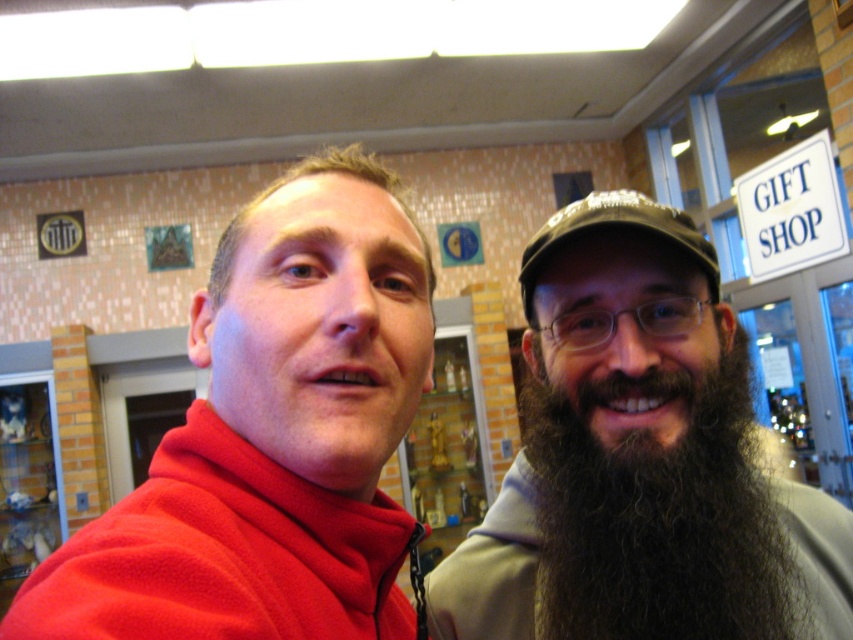
You are a photographer setting up a shot of the two people in the gift shop. You need to ensure that the matte fleece jacket at upper left and the green fabric cap at upper right are both visible in the frame. Based on their positions, which object is closer to the bottom edge of the photo?

The matte fleece jacket at upper left is below the green fabric cap at upper right, so it is closer to the bottom edge of the photo.

You are standing in a gift shop and see two items displayed on a shelf. The items are the matte fleece jacket at upper left and the green fabric cap at upper right. Which item is positioned to the right of the other?

The green fabric cap at upper right is positioned to the right of the matte fleece jacket at upper left.

You are a photographer trying to capture both the matte fleece jacket at upper left and the dark brown fuzzy beard at right in a single frame. Which object should you focus on first to ensure both are in the frame?

The matte fleece jacket at upper left is larger in size than dark brown fuzzy beard at right, so you should focus on the matte fleece jacket at upper left first to ensure both are in the frame.